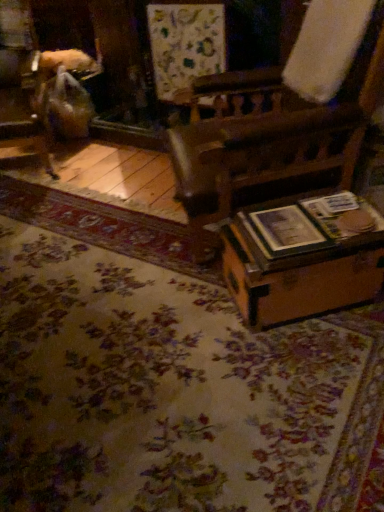
Find the location of `vacant space to the left of wooden trunk at lower right`. vacant space to the left of wooden trunk at lower right is located at coordinates pyautogui.click(x=194, y=313).